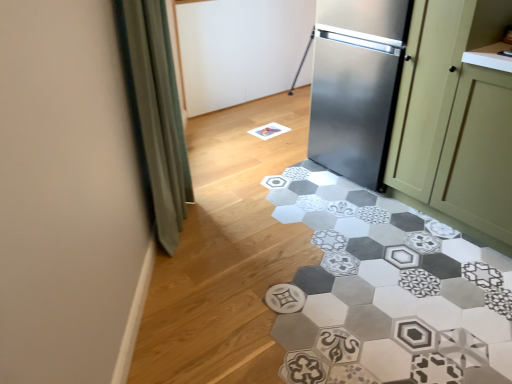
You are a GUI agent. You are given a task and a screenshot of the screen. Output one action in this format:
    pyautogui.click(x=<x>, y=<y>)
    Task: Click on the vacant space in between green fabric curtain at left and stainless steel cabinet at right
    
    Given the screenshot: What is the action you would take?
    pyautogui.click(x=281, y=204)